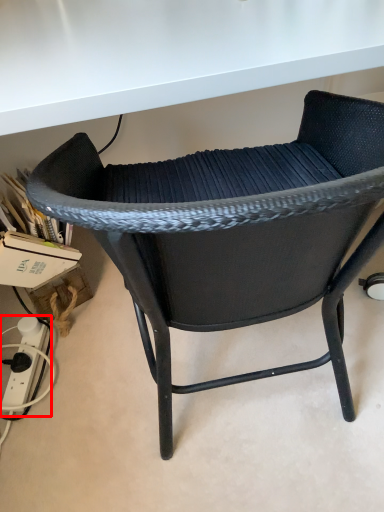
Question: Observing the image, what is the correct spatial positioning of plug (annotated by the red box) in reference to chair?

Choices:
 (A) left
 (B) right

Answer: (A)